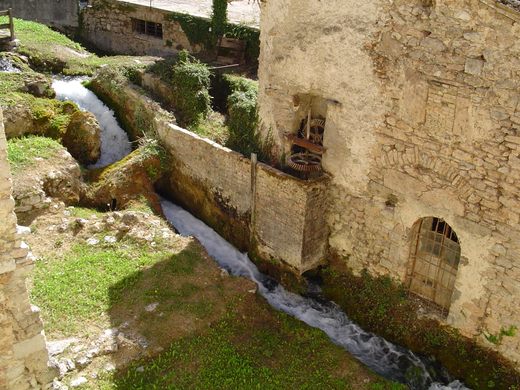
This screenshot has width=520, height=390. Find the location of `foam`. foam is located at coordinates (69, 87).